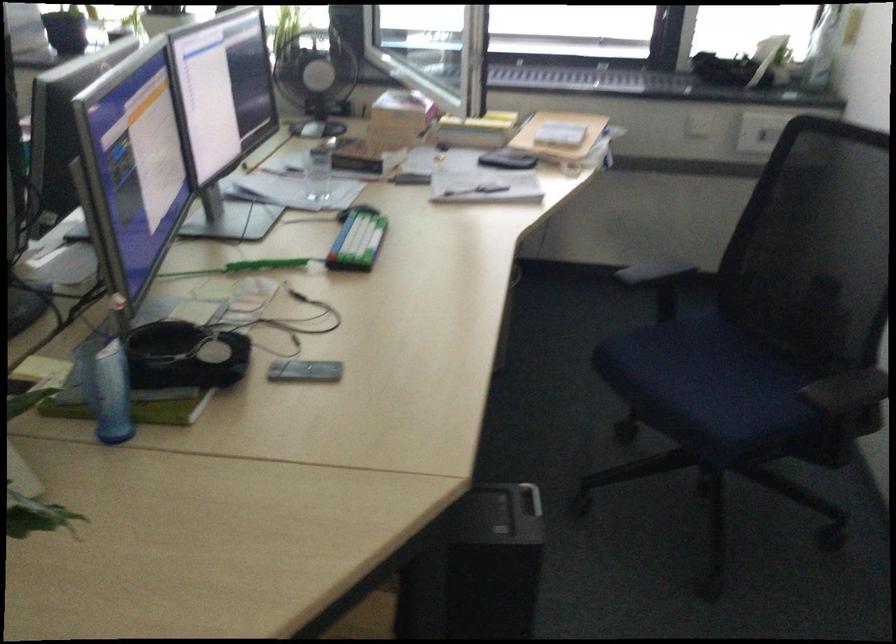
Identify the location of blue chair sitting surface. (734, 386).